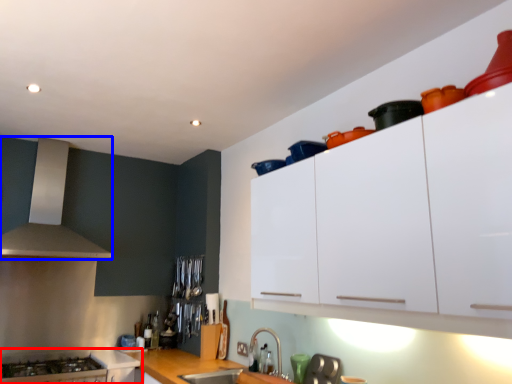
Question: Which point is further to the camera, cabinetry (highlighted by a red box) or kitchen appliance (highlighted by a blue box)?

Choices:
 (A) cabinetry
 (B) kitchen appliance

Answer: (B)